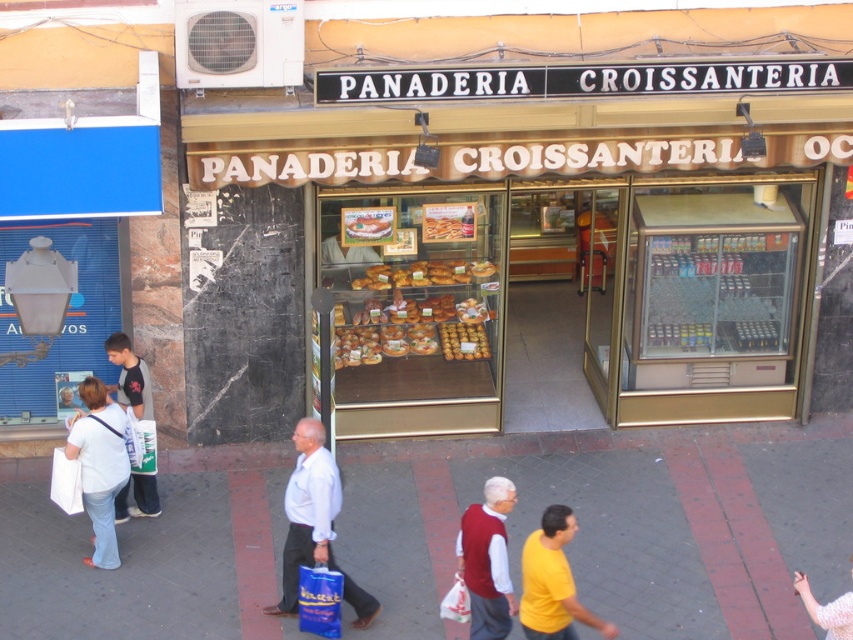
Question: Which of these objects is positioned closest to the white cotton shirt at lower right?

Choices:
 (A) golden brown pastries at center
 (B) white cotton shirt at left
 (C) yellow matte shirt at lower center
 (D) white cotton shirt at center

Answer: (C)

Question: Which point is closer to the camera?

Choices:
 (A) (149, 413)
 (B) (798, 570)
 (C) (363, 328)

Answer: (B)

Question: Does blue plastic bag at lower center have a larger size compared to golden brown pastry at center?

Choices:
 (A) no
 (B) yes

Answer: (B)

Question: Considering the relative positions of smooth concrete sidewalk at center and white cotton shirt at lower left in the image provided, where is smooth concrete sidewalk at center located with respect to white cotton shirt at lower left?

Choices:
 (A) right
 (B) left

Answer: (B)

Question: Does blue plastic bag at lower center come behind white plastic bag at lower center?

Choices:
 (A) yes
 (B) no

Answer: (A)

Question: Estimate the real-world distances between objects in this image. Which object is closer to the white plastic bag at lower center?

Choices:
 (A) white cotton shirt at lower right
 (B) yellow matte shirt at lower center
 (C) blue plastic bag at lower center
 (D) white cotton shirt at left

Answer: (B)